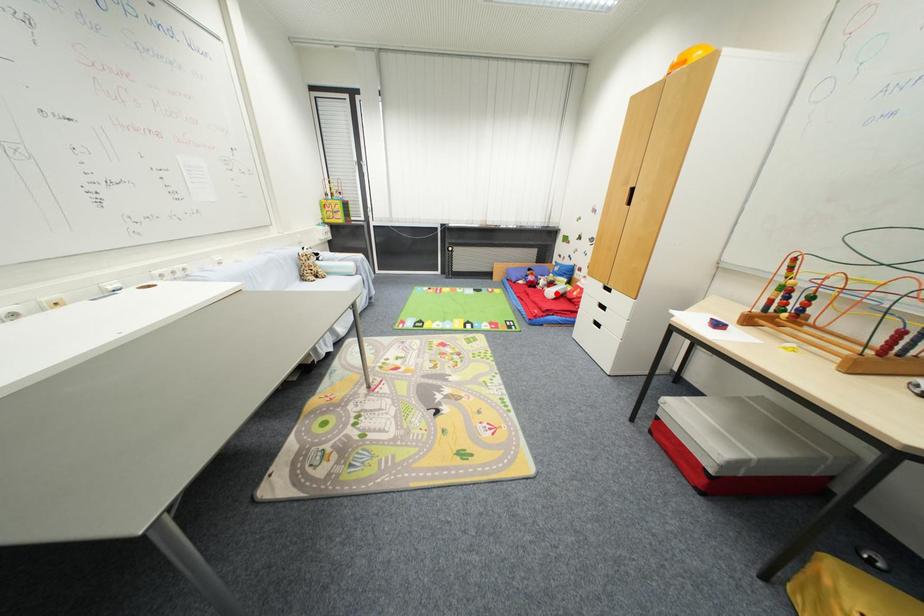
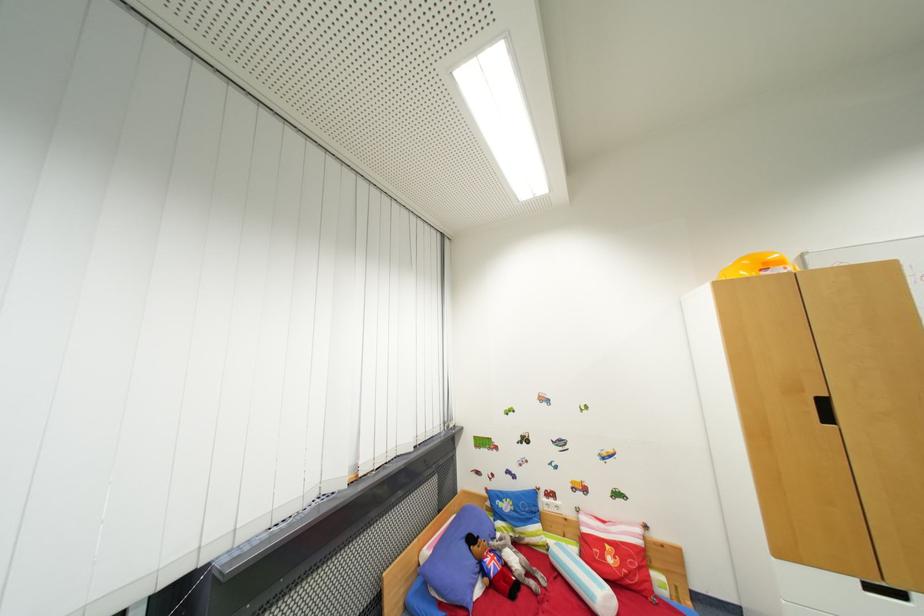
Locate, in the second image, the point that corresponds to the highlighted location in the first image.

(605, 596)